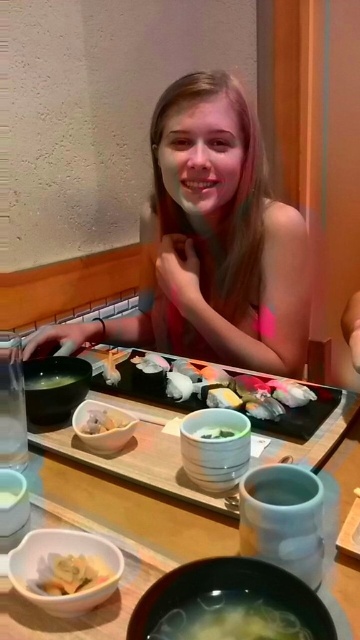
Between pink matte bikini top at center and white creamy dumpling at center, which one is positioned lower?

white creamy dumpling at center is below.

How distant is pink matte bikini top at center from white creamy dumpling at center?

pink matte bikini top at center is 19.72 inches from white creamy dumpling at center.

Between point (234, 349) and point (88, 417), which one is positioned in front?

Point (88, 417)

What are the coordinates of `pink matte bikini top at center` in the screenshot? It's located at (212, 243).

Does pink matte bikini top at center have a lesser height compared to black matte sushi platter at center?

No, pink matte bikini top at center is not shorter than black matte sushi platter at center.

Can you confirm if pink matte bikini top at center is positioned below black matte sushi platter at center?

No.

Where is `pink matte bikini top at center`? This screenshot has height=640, width=360. pink matte bikini top at center is located at coordinates (212, 243).

Who is positioned more to the right, wooden table at center or white creamy dumpling at center?

From the viewer's perspective, wooden table at center appears more on the right side.

Which is behind, point (200, 547) or point (115, 417)?

The point (115, 417) is more distant.

You are a GUI agent. You are given a task and a screenshot of the screen. Output one action in this format:
    pyautogui.click(x=<x>, y=<y>)
    Task: Click on the wooden table at center
    This screenshot has width=360, height=640.
    Given the screenshot: What is the action you would take?
    pyautogui.click(x=111, y=540)